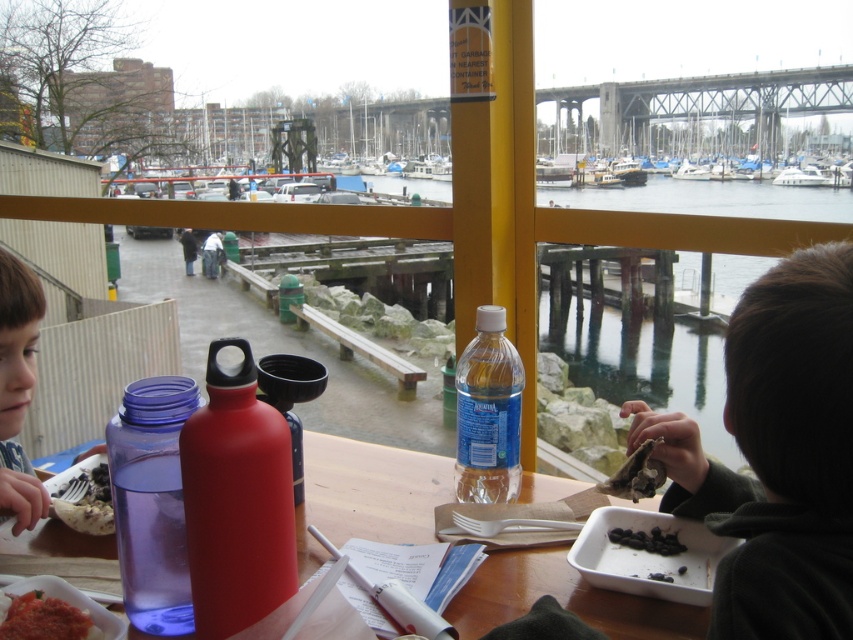
Who is positioned more to the right, red matte water bottle at center or dark brown crispy fish at lower right?

Positioned to the right is dark brown crispy fish at lower right.

Measure the distance between point (229,390) and camera.

Point (229,390) and camera are 25.04 inches apart.

This screenshot has width=853, height=640. Describe the element at coordinates (236, 500) in the screenshot. I see `red matte water bottle at center` at that location.

This screenshot has height=640, width=853. I want to click on red matte water bottle at center, so click(x=236, y=500).

Is black matte tray at lower right closer to camera compared to smooth pinkish paste at lower left?

No.

Is black matte tray at lower right smaller than smooth pinkish paste at lower left?

Actually, black matte tray at lower right might be larger than smooth pinkish paste at lower left.

The height and width of the screenshot is (640, 853). In order to click on black matte tray at lower right in this screenshot , I will do `click(648, 556)`.

At what (x,y) coordinates should I click in order to perform the action: click on black matte tray at lower right. Please return your answer as a coordinate pair (x, y). The width and height of the screenshot is (853, 640). Looking at the image, I should click on (648, 556).

Is red matte water bottle at center positioned behind black matte tray at lower right?

No, it is in front of black matte tray at lower right.

Who is shorter, red matte water bottle at center or black matte tray at lower right?

black matte tray at lower right

Where is `red matte water bottle at center`? red matte water bottle at center is located at coordinates (236, 500).

What are the coordinates of `red matte water bottle at center` in the screenshot? It's located at (236, 500).